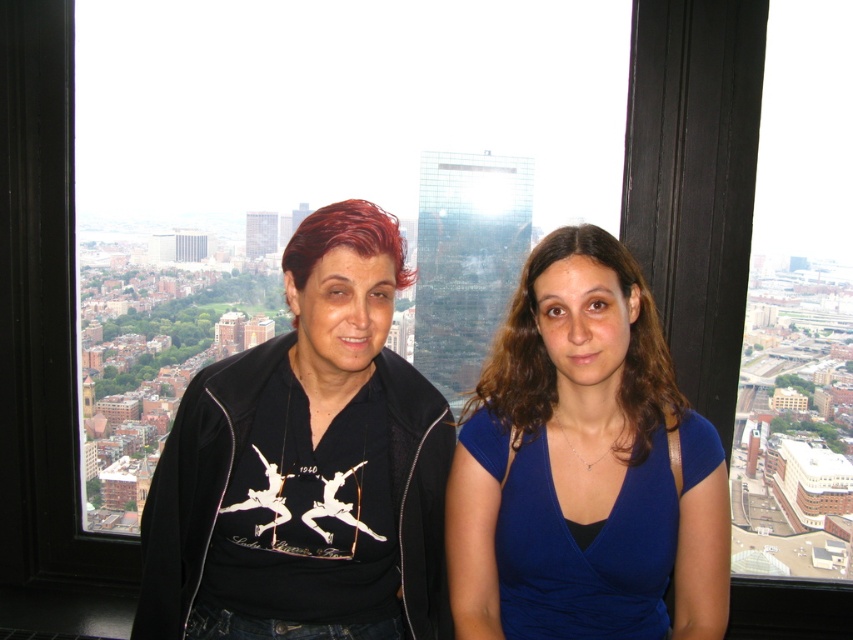
Question: Observing the image, what is the correct spatial positioning of black matte shirt at center in reference to blue velvet dress at center?

Choices:
 (A) right
 (B) left

Answer: (B)

Question: Among these objects, which one is nearest to the camera?

Choices:
 (A) blue velvet dress at center
 (B) black matte shirt at center

Answer: (B)

Question: Can you confirm if black matte shirt at center is wider than blue velvet dress at center?

Choices:
 (A) no
 (B) yes

Answer: (B)

Question: Does black matte shirt at center have a smaller size compared to blue velvet dress at center?

Choices:
 (A) yes
 (B) no

Answer: (B)

Question: Which of the following is the closest to the observer?

Choices:
 (A) blue velvet dress at center
 (B) black matte shirt at center

Answer: (B)